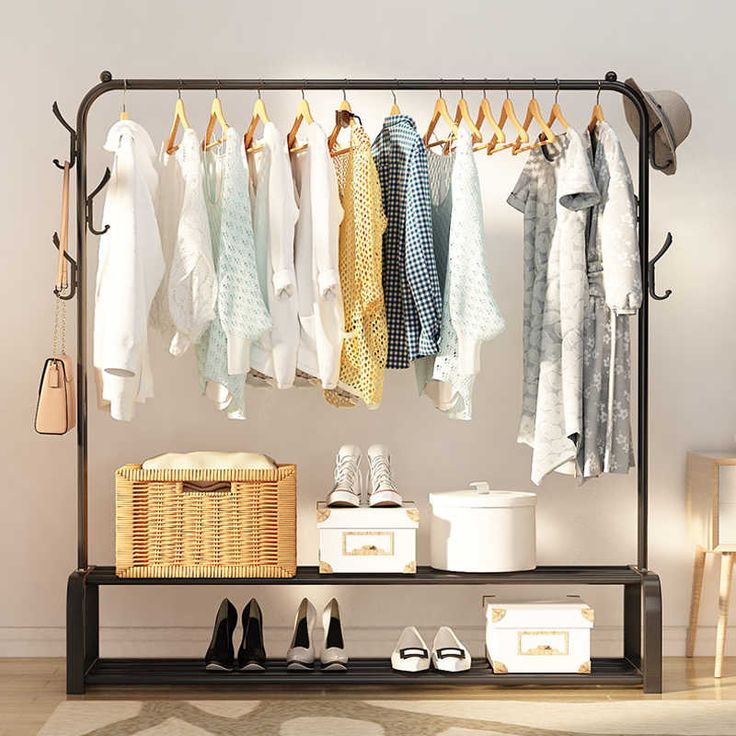
This screenshot has height=736, width=736. Find the location of `indivdual shoes`. indivdual shoes is located at coordinates (227, 659), (263, 665), (286, 659), (319, 661), (406, 654), (456, 656), (339, 494), (396, 489).